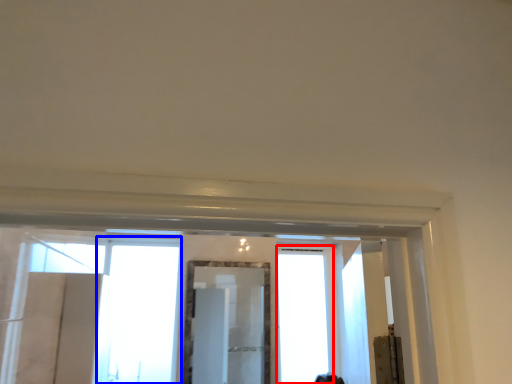
Question: Which point is closer to the camera, window (highlighted by a red box) or window (highlighted by a blue box)?

Choices:
 (A) window
 (B) window

Answer: (B)